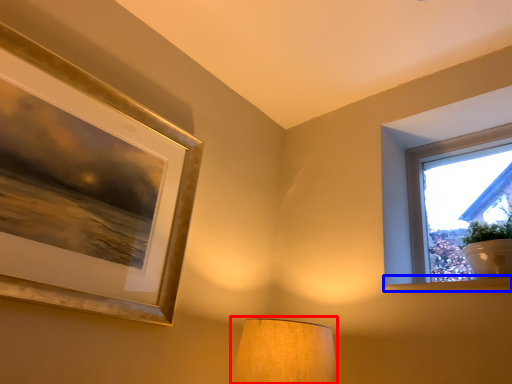
Question: Which of the following is the closest to the observer, lamp (highlighted by a red box) or window sill (highlighted by a blue box)?

Choices:
 (A) lamp
 (B) window sill

Answer: (A)